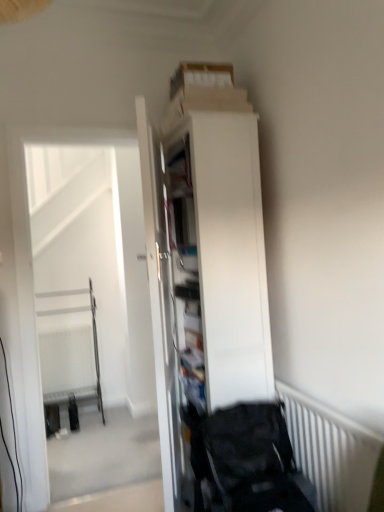
Question: Can you confirm if white glossy door at center is positioned to the left of white matte cabinet at center?

Choices:
 (A) yes
 (B) no

Answer: (A)

Question: Considering the relative sizes of white glossy door at center and white matte cabinet at center in the image provided, is white glossy door at center bigger than white matte cabinet at center?

Choices:
 (A) yes
 (B) no

Answer: (B)

Question: Is white glossy door at center wider than white matte cabinet at center?

Choices:
 (A) no
 (B) yes

Answer: (A)

Question: Is white glossy door at center not near white matte cabinet at center?

Choices:
 (A) yes
 (B) no

Answer: (B)

Question: From a real-world perspective, is white glossy door at center located higher than white matte cabinet at center?

Choices:
 (A) yes
 (B) no

Answer: (B)

Question: From their relative heights in the image, would you say white striped radiator at lower right is taller or shorter than black fabric baby carriage at lower right?

Choices:
 (A) short
 (B) tall

Answer: (B)

Question: Looking at the image, does white striped radiator at lower right seem bigger or smaller compared to black fabric baby carriage at lower right?

Choices:
 (A) small
 (B) big

Answer: (A)

Question: From the image's perspective, is white striped radiator at lower right positioned above or below black fabric baby carriage at lower right?

Choices:
 (A) above
 (B) below

Answer: (B)

Question: Is white striped radiator at lower right wider or thinner than black fabric baby carriage at lower right?

Choices:
 (A) thin
 (B) wide

Answer: (A)

Question: Do you think white matte cabinet at center is within white striped radiator at lower right, or outside of it?

Choices:
 (A) inside
 (B) outside

Answer: (B)

Question: From the image's perspective, relative to white striped radiator at lower right, is white matte cabinet at center above or below?

Choices:
 (A) below
 (B) above

Answer: (B)

Question: Looking at the image, does white matte cabinet at center seem bigger or smaller compared to white striped radiator at lower right?

Choices:
 (A) big
 (B) small

Answer: (A)

Question: Is white matte cabinet at center taller or shorter than white striped radiator at lower right?

Choices:
 (A) short
 (B) tall

Answer: (B)

Question: From the image's perspective, relative to white matte cabinet at center, is black fabric baby carriage at lower right above or below?

Choices:
 (A) above
 (B) below

Answer: (B)

Question: Looking at their shapes, would you say black fabric baby carriage at lower right is wider or thinner than white matte cabinet at center?

Choices:
 (A) wide
 (B) thin

Answer: (B)